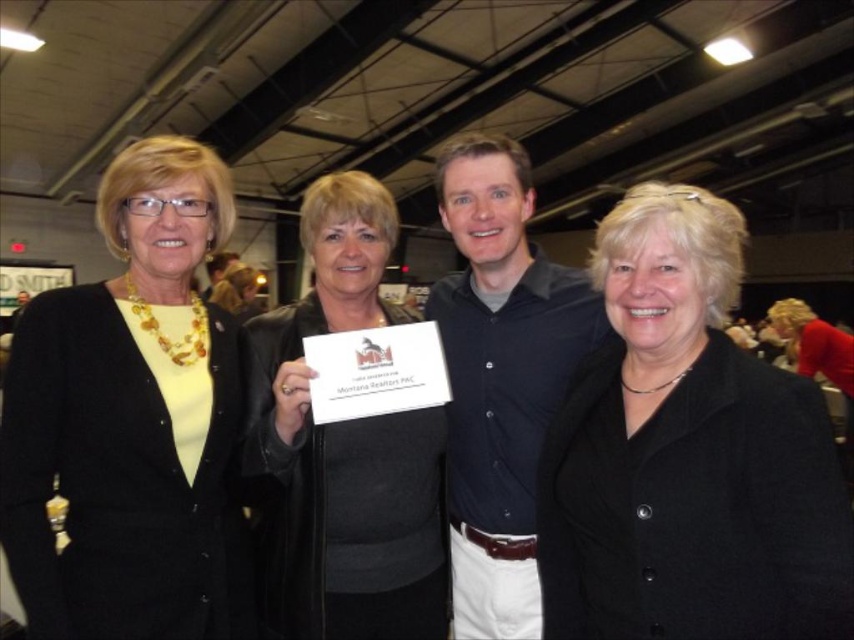
This screenshot has height=640, width=854. What do you see at coordinates (687, 454) in the screenshot?
I see `black matte jacket at center` at bounding box center [687, 454].

Is the position of black matte jacket at center less distant than that of yellow matte cardigan at left?

Yes, it is in front of yellow matte cardigan at left.

Which is behind, point (657, 358) or point (223, 596)?

The point (223, 596) is behind.

The image size is (854, 640). In order to click on black matte jacket at center in this screenshot , I will do `click(687, 454)`.

From the picture: Does black leather jacket at center appear under dark blue shirt at center?

Indeed, black leather jacket at center is positioned under dark blue shirt at center.

Who is positioned more to the left, black leather jacket at center or dark blue shirt at center?

black leather jacket at center is more to the left.

Between point (330, 522) and point (560, 291), which one is positioned in front?

Positioned in front is point (330, 522).

Image resolution: width=854 pixels, height=640 pixels. I want to click on black leather jacket at center, so click(x=342, y=449).

Can you confirm if yellow matte cardigan at left is bigger than black leather jacket at center?

Actually, yellow matte cardigan at left might be smaller than black leather jacket at center.

Is yellow matte cardigan at left behind black leather jacket at center?

No, yellow matte cardigan at left is closer to the viewer.

Is point (143, 595) positioned after point (366, 326)?

No, it is in front of (366, 326).

The image size is (854, 640). I want to click on yellow matte cardigan at left, so click(130, 422).